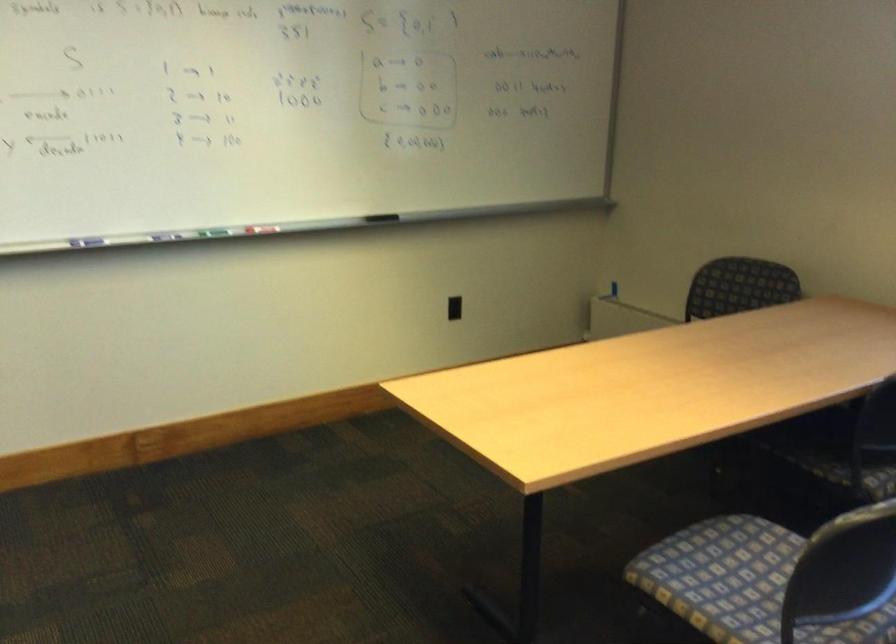
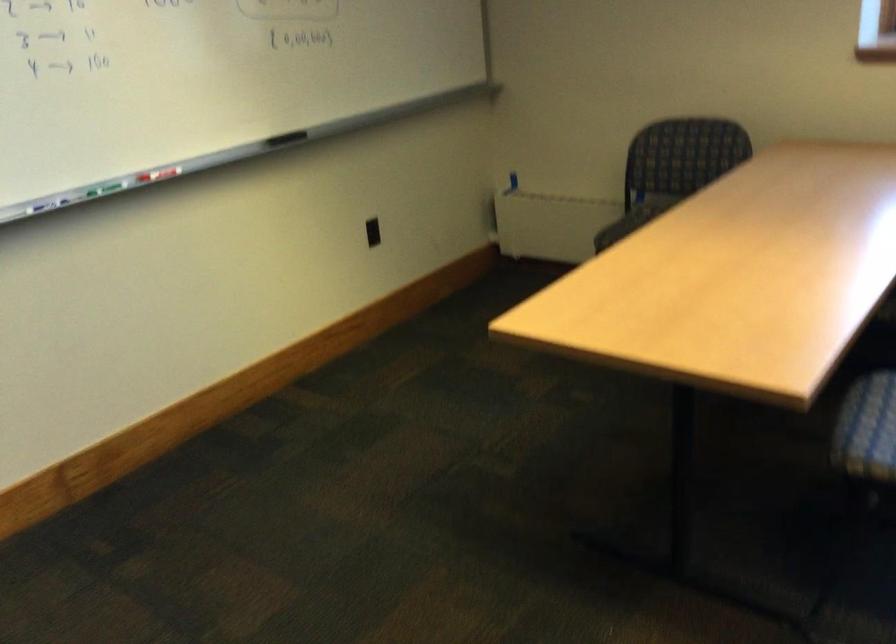
Locate, in the second image, the point that corresponds to (161,231) in the first image.

(47, 204)